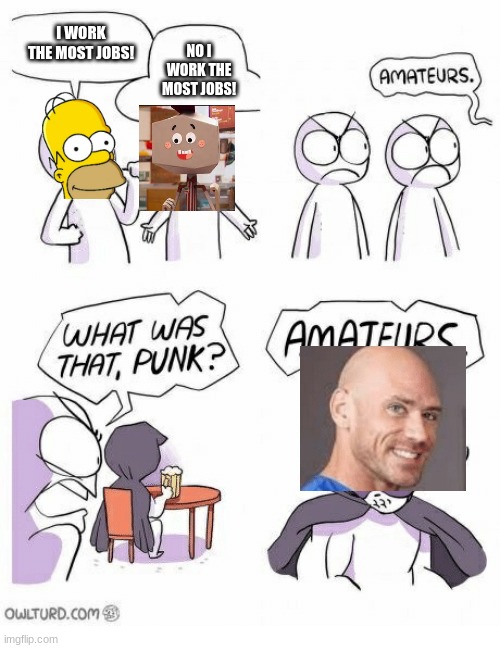
Where is `chair`? chair is located at coordinates (118, 516).